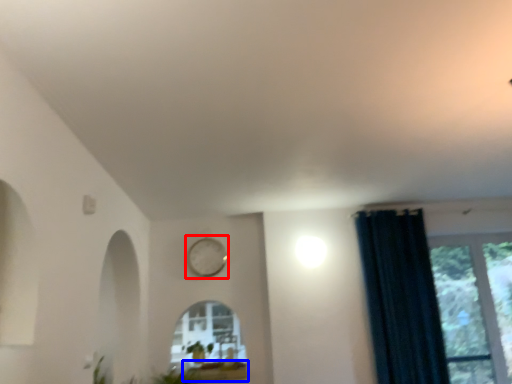
Question: Among these objects, which one is farthest to the camera, clock (highlighted by a red box) or window sill (highlighted by a blue box)?

Choices:
 (A) clock
 (B) window sill

Answer: (A)